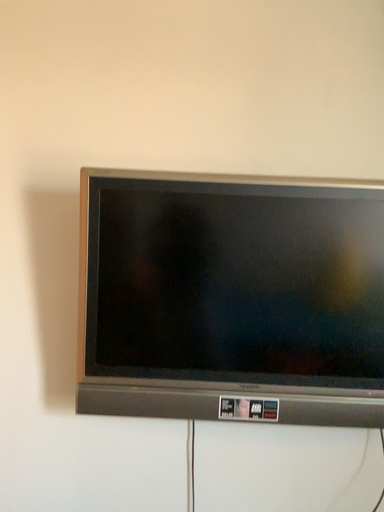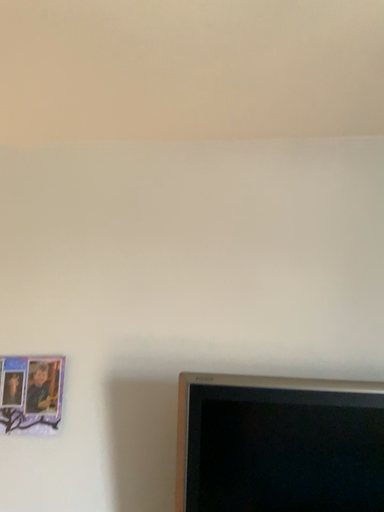
Question: How did the camera likely rotate when shooting the video?

Choices:
 (A) rotated downward
 (B) rotated upward

Answer: (B)